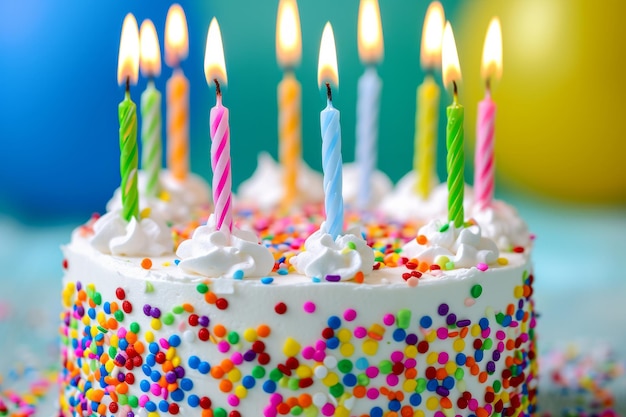
This screenshot has width=626, height=417. I want to click on birthday candle, so click(x=490, y=151), click(x=454, y=161), click(x=423, y=135), click(x=367, y=126), click(x=330, y=142), click(x=295, y=122), click(x=222, y=147), click(x=177, y=118), click(x=156, y=122), click(x=126, y=147).